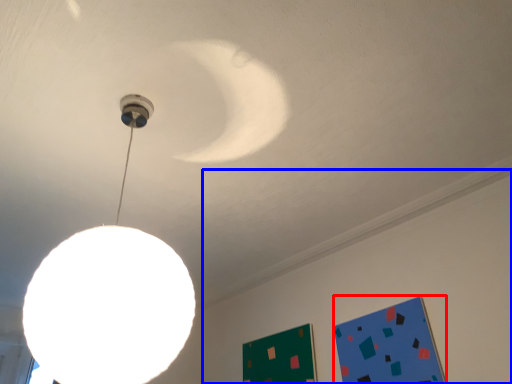
Question: Which of the following is the closest to the observer, bulletin board (highlighted by a red box) or backdrop (highlighted by a blue box)?

Choices:
 (A) bulletin board
 (B) backdrop

Answer: (B)